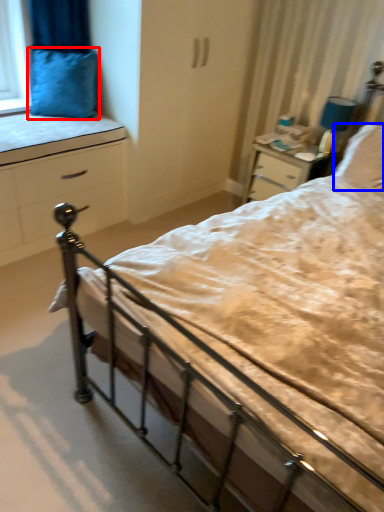
Question: Among these objects, which one is farthest to the camera, pillow (highlighted by a red box) or pillow (highlighted by a blue box)?

Choices:
 (A) pillow
 (B) pillow

Answer: (A)